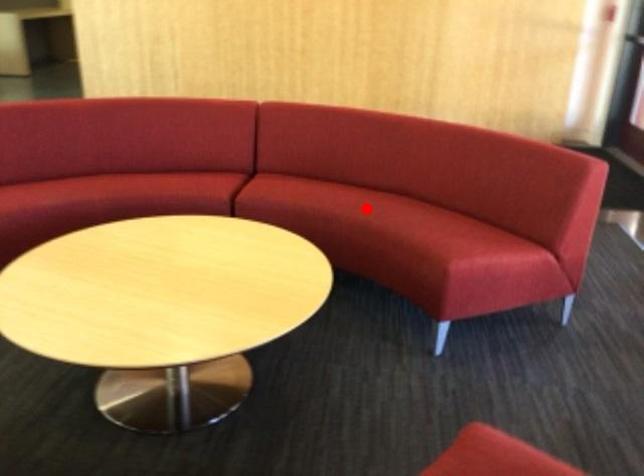
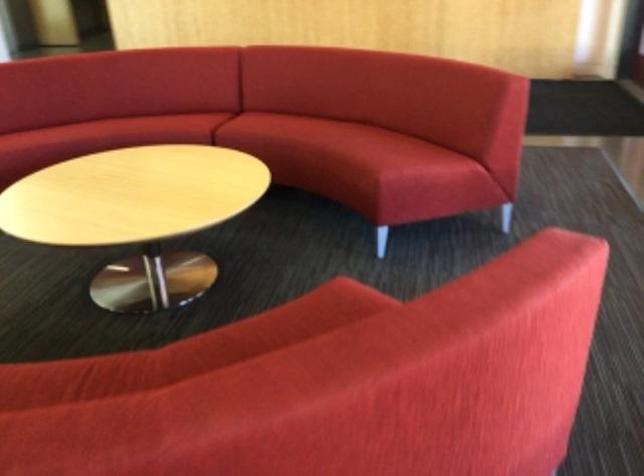
Question: I am providing you with two images of the same scene from different viewpoints. Image1 has a red point marked. In image2, the corresponding 3D location appears at what relative position? Reply with the corresponding letter.

Choices:
 (A) Closer
 (B) Farther

Answer: (B)